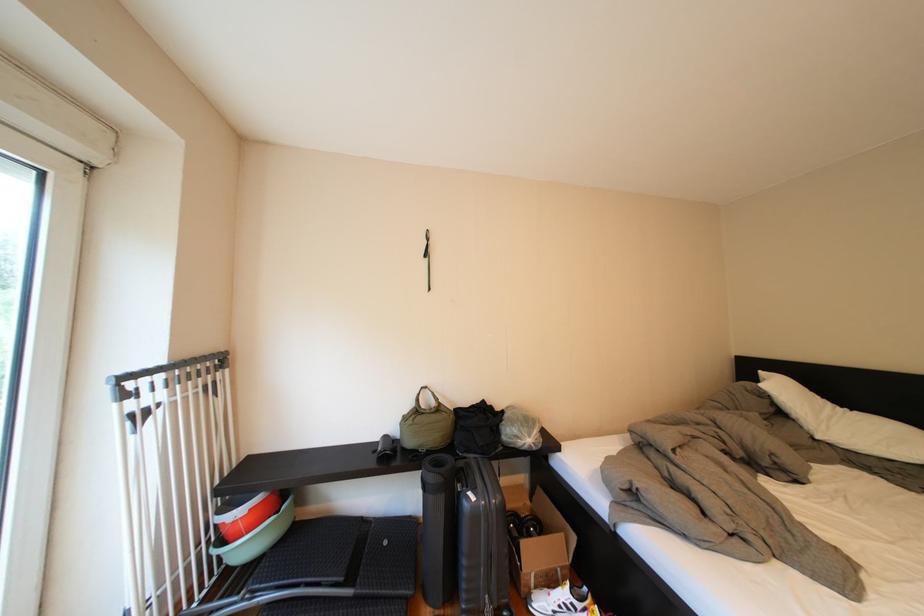
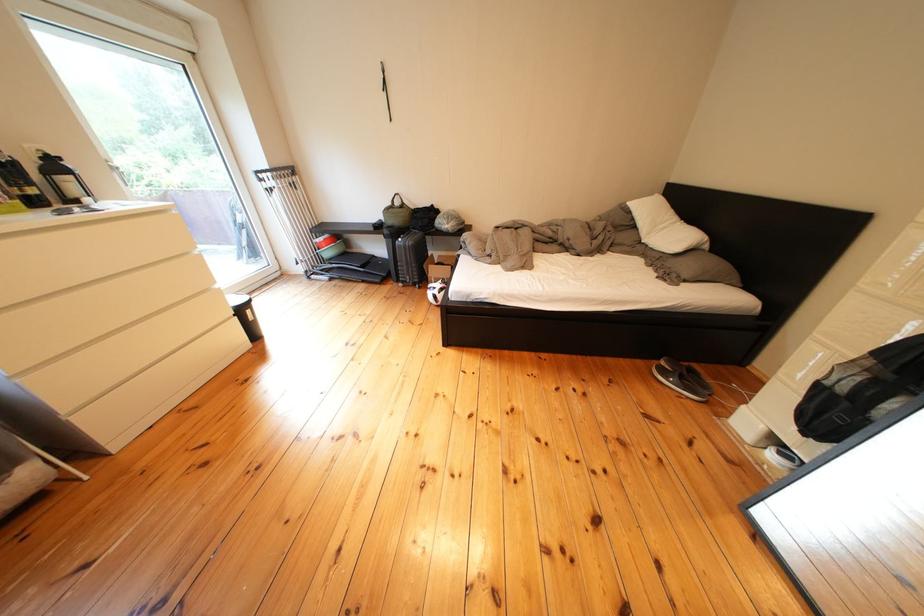
In the second image, find the point that corresponds to point (444, 480) in the first image.

(399, 236)